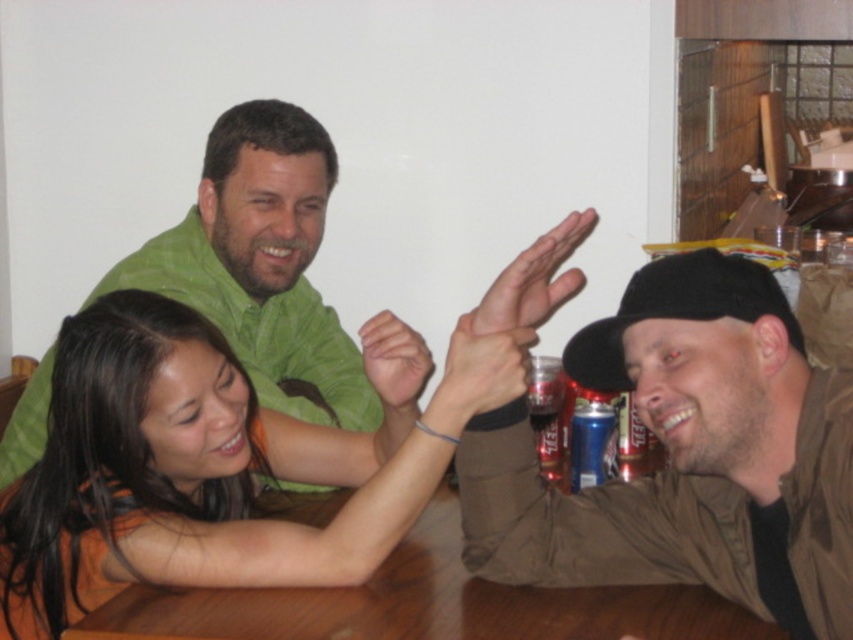
Based on the photo, you are a photographer trying to capture a closeup of the green matte shirt at upper left and the brown wooden table at center. Which object should you zoom in on to ensure both are in frame without moving the camera?

The green matte shirt at upper left has a lesser width compared to brown wooden table at center, so you should zoom in on the brown wooden table at center since it is wider and will require more focus to capture in the frame.

You are a photographer standing behind the green matte shirt at upper left and the brown wooden table at center. You want to take a photo of the scene so that both objects are fully visible. Which object should you position closer to the camera to ensure both are in frame?

The green matte shirt at upper left is taller than the brown wooden table at center, so you should position the green matte shirt at upper left closer to the camera to ensure both are fully visible in the photo.

You are standing at the point marked by the coordinates point (209, 465). What object is located exactly at this point?

The point (209, 465) marks orange fabric shirt at center.